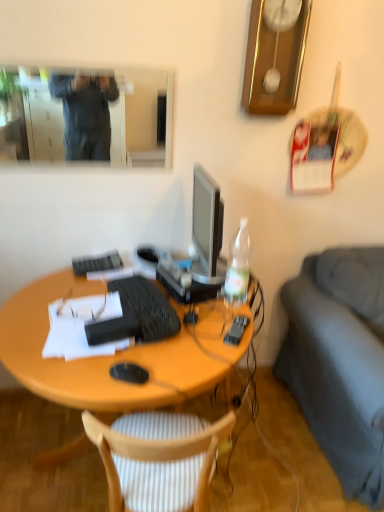
In order to click on space that is in front of black plastic remote control at right in this screenshot , I will do `click(213, 359)`.